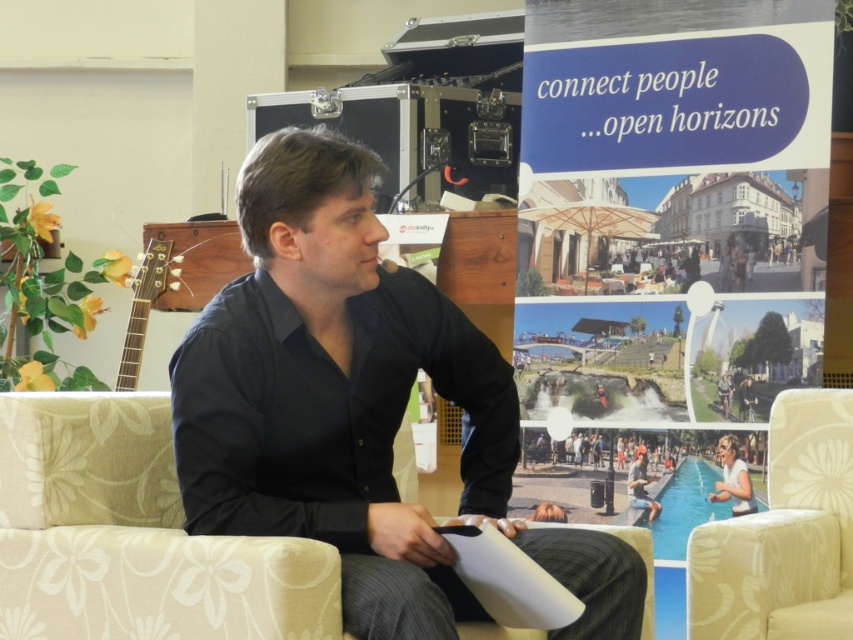
Question: Which is nearer to the beige fabric couch at center?

Choices:
 (A) beige floral fabric armchair at lower right
 (B) black matte shirt at center
 (C) matte black shirt at center
 (D) blue paper sign at upper right

Answer: (B)

Question: Which is farther from the black matte shirt at center?

Choices:
 (A) beige floral fabric armchair at lower right
 (B) white matte clipboard at lower center
 (C) beige fabric couch at center
 (D) blue paper sign at upper right

Answer: (D)

Question: Can you confirm if white matte clipboard at lower center is smaller than matte black shirt at center?

Choices:
 (A) no
 (B) yes

Answer: (A)

Question: Among these objects, which one is nearest to the camera?

Choices:
 (A) beige floral fabric armchair at lower right
 (B) black matte shirt at center
 (C) white matte clipboard at lower center
 (D) matte black shirt at center

Answer: (B)

Question: Is black matte shirt at center bigger than matte black shirt at center?

Choices:
 (A) no
 (B) yes

Answer: (B)

Question: Does beige fabric couch at center appear over beige floral fabric armchair at lower right?

Choices:
 (A) yes
 (B) no

Answer: (B)